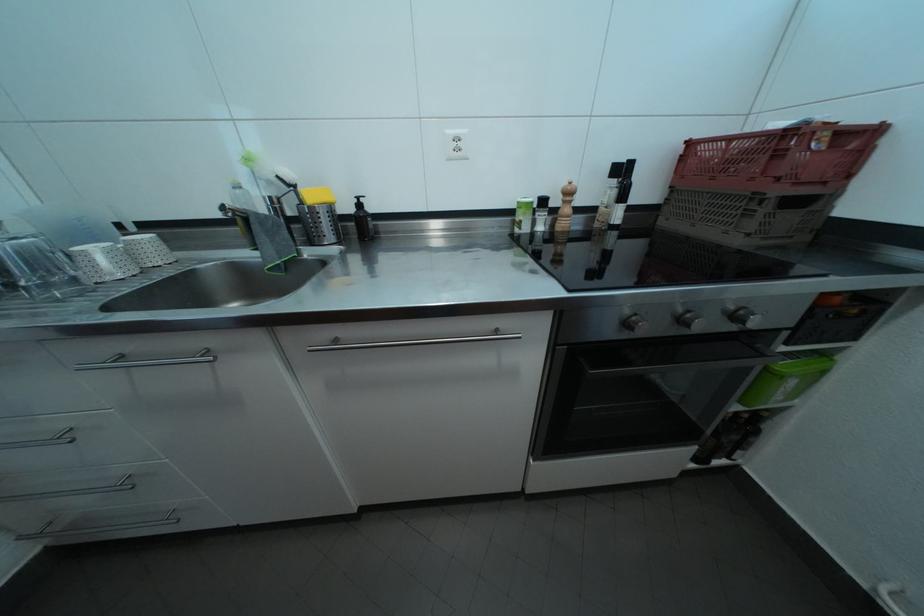
Find where to turn the wooden pepper mill. Please return your answer as a coordinate pair (x, y).

(565, 212)